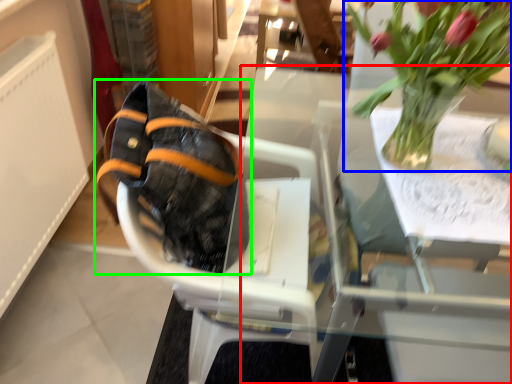
Question: Estimate the real-world distances between objects in this image. Which object is closer to table (highlighted by a red box), houseplant (highlighted by a blue box) or footwear (highlighted by a green box)?

Choices:
 (A) houseplant
 (B) footwear

Answer: (A)